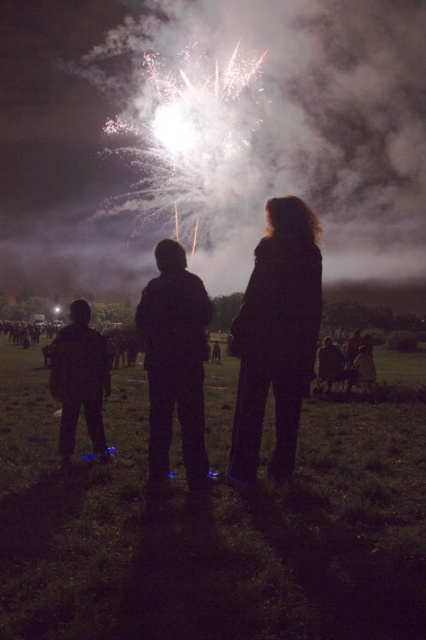
Looking at this image, which is above, dark fabric coat at center or black matte jacket at center?

Positioned higher is black matte jacket at center.

Does dark fabric coat at center appear on the right side of black matte jacket at center?

Yes, dark fabric coat at center is to the right of black matte jacket at center.

The width and height of the screenshot is (426, 640). I want to click on dark fabric coat at center, so click(x=276, y=337).

Find the location of a particular element. This screenshot has width=426, height=640. dark fabric coat at center is located at coordinates (276, 337).

Who is more distant from viewer, (233, 428) or (100, 388)?

Point (100, 388)

Looking at this image, measure the distance between dark fabric coat at center and camera.

The distance of dark fabric coat at center from camera is 16.97 feet.

Where is `dark fabric coat at center`? This screenshot has height=640, width=426. dark fabric coat at center is located at coordinates (276, 337).

How distant is black matte jacket at center from dark blue jeans at lower left?

1.71 meters

Does black matte jacket at center appear under dark blue jeans at lower left?

No, black matte jacket at center is not below dark blue jeans at lower left.

Who is more distant from viewer, [190,328] or [62,442]?

The point [62,442] is more distant.

At what (x,y) coordinates should I click in order to perform the action: click on black matte jacket at center. Please return your answer as a coordinate pair (x, y). The height and width of the screenshot is (640, 426). Looking at the image, I should click on (175, 360).